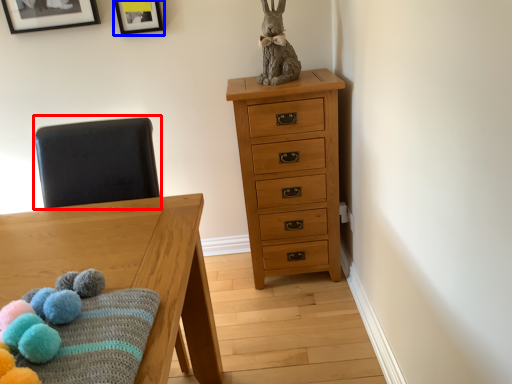
Question: Which object appears farthest to the camera in this image, swivel chair (highlighted by a red box) or picture frame (highlighted by a blue box)?

Choices:
 (A) swivel chair
 (B) picture frame

Answer: (B)